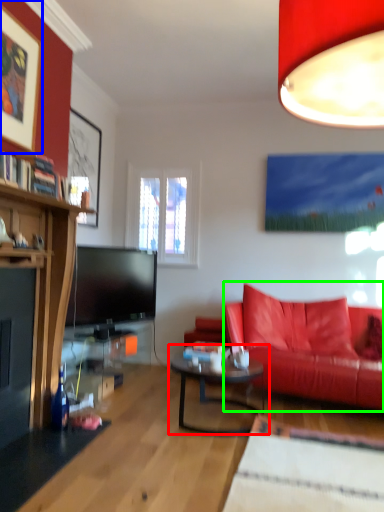
Question: Based on their relative distances, which object is farther from coffee table (highlighted by a red box)? Choose from picture frame (highlighted by a blue box) and studio couch (highlighted by a green box).

Choices:
 (A) picture frame
 (B) studio couch

Answer: (A)